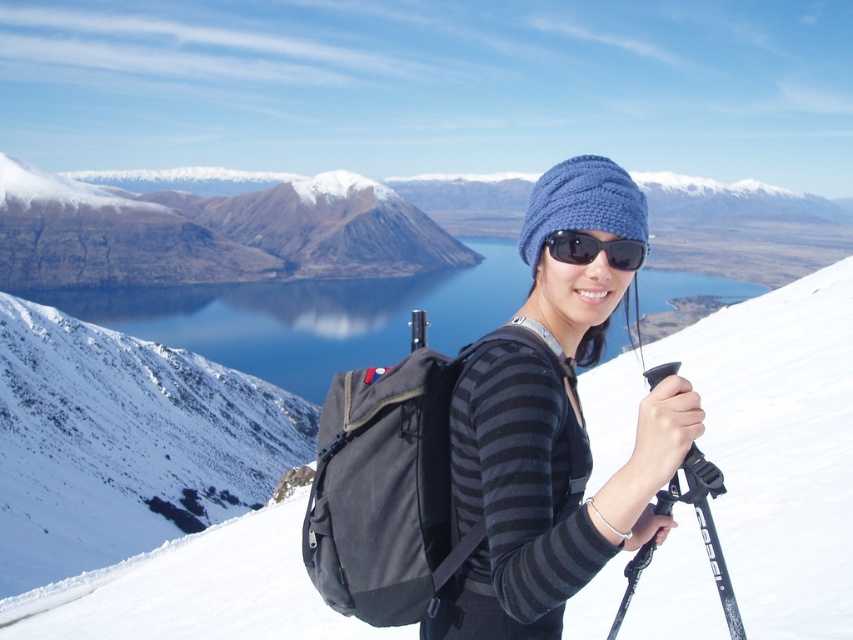
Question: Which of these objects is positioned closest to the blue water at center?

Choices:
 (A) black canvas backpack at center
 (B) knitted blue hat at center
 (C) black reflective sunglasses at center

Answer: (B)

Question: Considering the relative positions of knitted blue hat at center and black plastic ski pole at lower right in the image provided, where is knitted blue hat at center located with respect to black plastic ski pole at lower right?

Choices:
 (A) right
 (B) left

Answer: (B)

Question: Which point is closer to the camera?

Choices:
 (A) (595, 497)
 (B) (276, 332)

Answer: (A)

Question: Does black plastic ski pole at lower right appear on the right side of black reflective sunglasses at center?

Choices:
 (A) no
 (B) yes

Answer: (B)

Question: Among these objects, which one is farthest from the camera?

Choices:
 (A) black plastic ski pole at lower right
 (B) knitted blue hat at center
 (C) matte black backpack at center

Answer: (C)

Question: In this image, where is brown textured mountain at upper left located relative to black reflective sunglasses at center?

Choices:
 (A) below
 (B) above

Answer: (B)